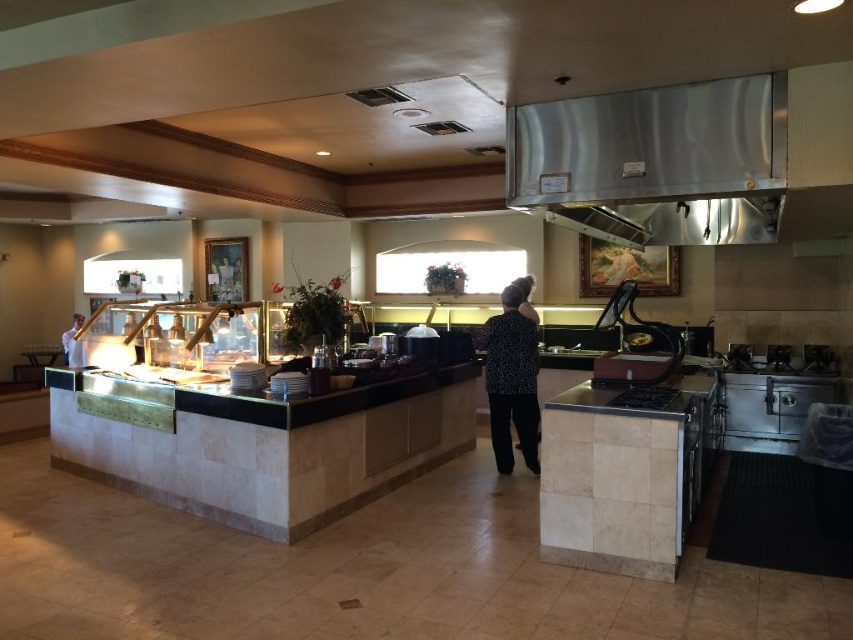
Between point (495, 419) and point (79, 314), which one is positioned in front?

Positioned in front is point (495, 419).

Is point (502, 422) closer to camera compared to point (67, 346)?

Yes, it is in front of point (67, 346).

This screenshot has height=640, width=853. What are the coordinates of `black dotted shirt at center` in the screenshot? It's located at (511, 380).

Who is more forward, (500, 451) or (618, 241)?

Point (500, 451) is more forward.

Is black dotted shirt at center bigger than stainless steel exhaust hood at upper center?

No, black dotted shirt at center is not bigger than stainless steel exhaust hood at upper center.

Between point (524, 372) and point (584, 228), which one is positioned behind?

The point (524, 372) is behind.

Find the location of `black dotted shirt at center`. black dotted shirt at center is located at coordinates (511, 380).

Is point (553, 212) closer to camera compared to point (80, 323)?

Yes, it is in front of point (80, 323).

Which is below, stainless steel exhaust hood at upper center or white shirt at left?

white shirt at left is below.

Between point (618, 236) and point (62, 348), which one is positioned in front?

Point (618, 236) is in front.

Identify the location of stainless steel exhaust hood at upper center. Image resolution: width=853 pixels, height=640 pixels. (599, 224).